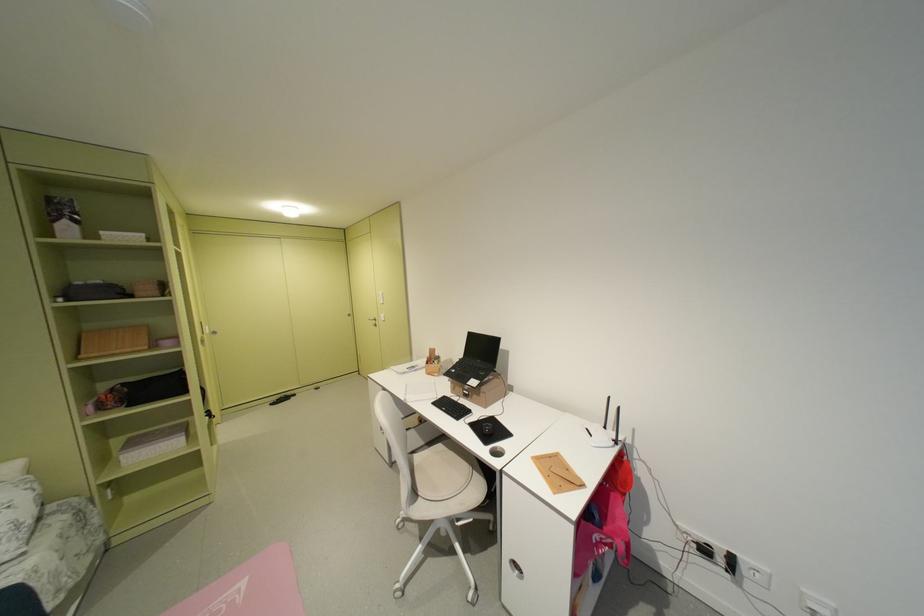
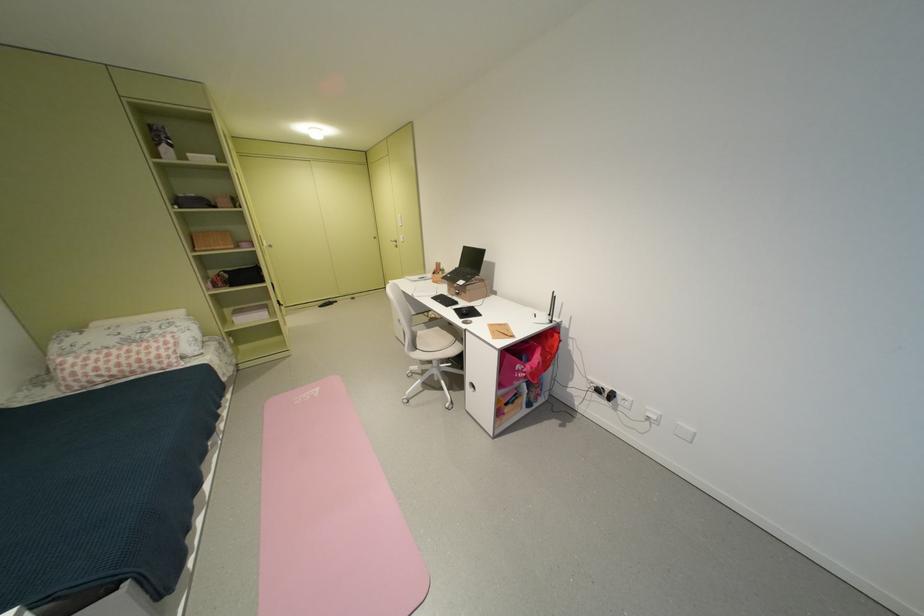
The point at (359, 315) is marked in the first image. Where is the corresponding point in the second image?

(383, 238)